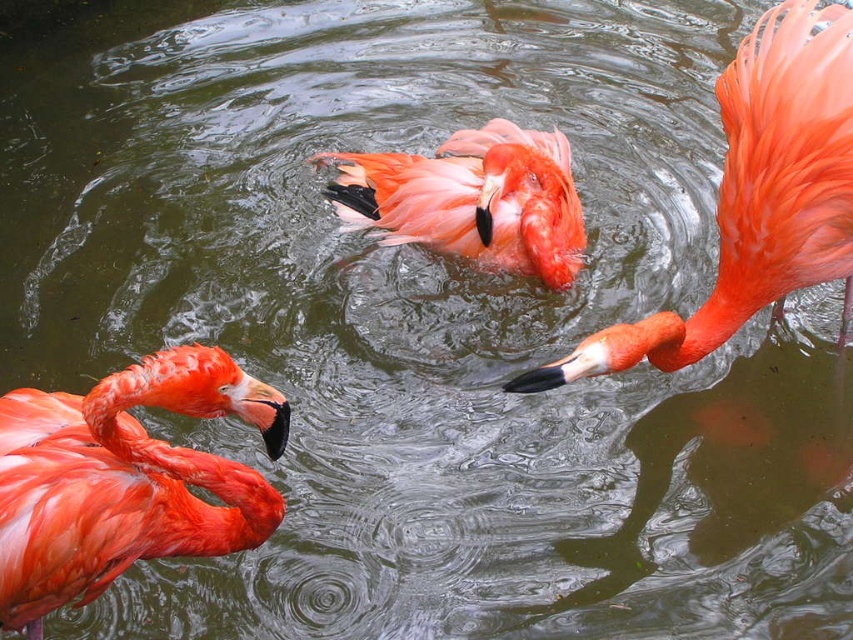
Question: Estimate the real-world distances between objects in this image. Which object is farther from the matte pink flamingo at center?

Choices:
 (A) matte pink flamingo at left
 (B) matte orange flamingo at right

Answer: (A)

Question: Does matte pink flamingo at left have a larger size compared to matte orange flamingo at right?

Choices:
 (A) yes
 (B) no

Answer: (B)

Question: Which of the following is the closest to the observer?

Choices:
 (A) matte orange flamingo at right
 (B) matte pink flamingo at center
 (C) matte pink flamingo at left

Answer: (C)

Question: Is matte orange flamingo at right above matte pink flamingo at center?

Choices:
 (A) no
 (B) yes

Answer: (A)

Question: Is matte orange flamingo at right below matte pink flamingo at center?

Choices:
 (A) no
 (B) yes

Answer: (B)

Question: Which of the following is the farthest from the observer?

Choices:
 (A) matte pink flamingo at left
 (B) matte pink flamingo at center

Answer: (B)